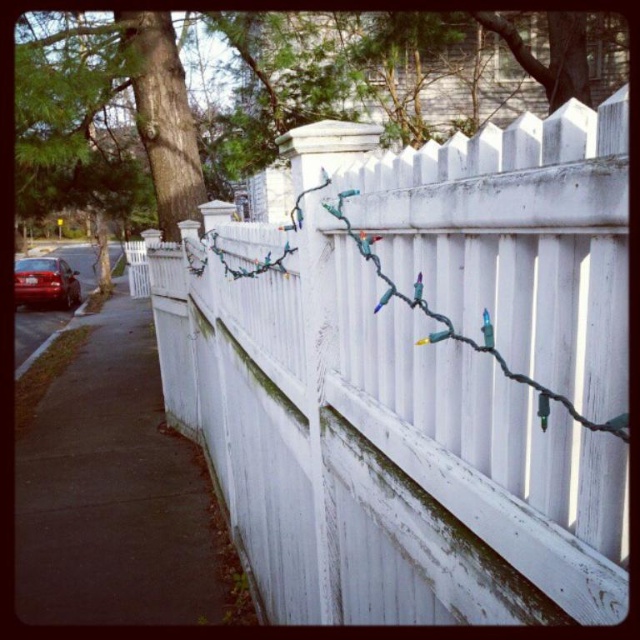
Looking at this image, you are a delivery person trying to park your vehicle. You see the white painted wood fence at center and the matte black car at left. Which object is closer to the street level?

The white painted wood fence at center is located below the matte black car at left, so it is closer to the street level.

Based on the photo, you are a delivery person trying to see if you can spot the matte black car at left behind the white painted wood fence at center. Based on their heights, can you see the car fully from this angle?

The white painted wood fence at center is shorter than the matte black car at left, so yes, you can see the matte black car at left fully since the fence does not block its view.